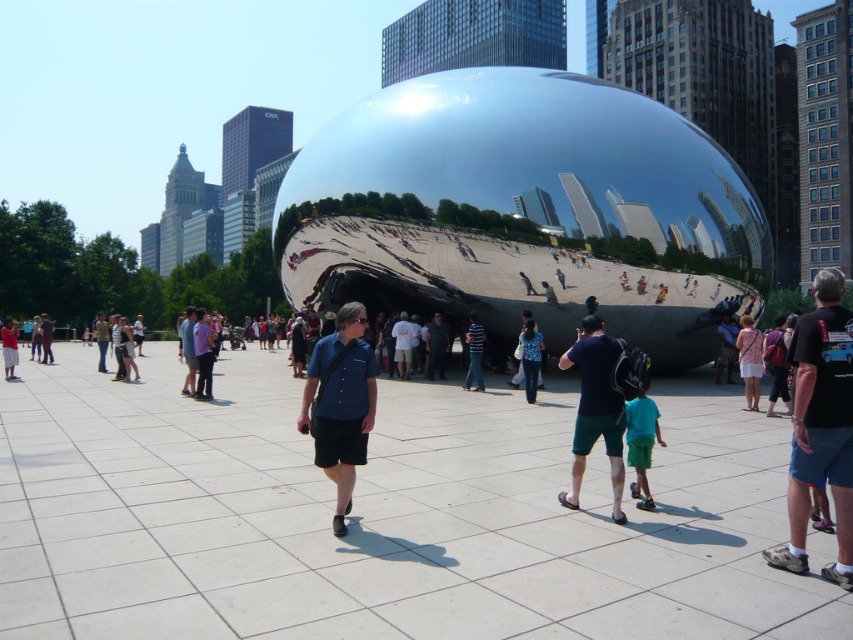
You are a photographer standing in front of Cloud Gate in Millennium Park. You notice a person wearing denim pants at center and a striped shirt at center. If you want to capture both subjects clearly in one photo, which clothing item should you focus on to ensure both are in sharp focus?

You should focus on the denim pants at center because it is in front of the striped shirt at center, ensuring both will be in focus when the foreground is sharp.

You are a photographer planning to capture a candid shot of the denim pants at center and striped shirt at center in the crowd near Cloud Gate. Since you want to focus on the clothing details, which clothing item should you zoom in on to ensure it appears larger in your photo?

The striped shirt at center has a greater width than the denim pants at center, so to capture more detail, you should zoom in on the striped shirt at center.

You are a photographer trying to capture the reflection of the striped shirt at center and the matte black shorts at lower left in Cloud Gate. Since the sculpture reflects the surroundings, which object would appear narrower in the reflection?

The striped shirt at center would appear narrower in the reflection because it has a lesser width compared to the matte black shorts at lower left.